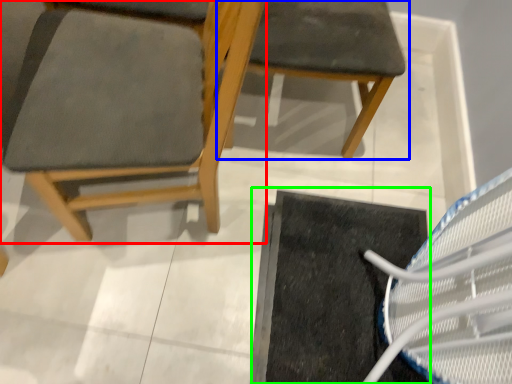
Question: Which object is positioned farthest from chair (highlighted by a red box)? Select from chair (highlighted by a blue box) and doormat (highlighted by a green box).

Choices:
 (A) chair
 (B) doormat

Answer: (B)